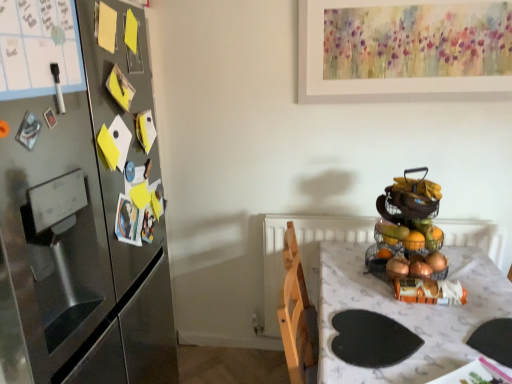
Identify the location of vacant area located to the right-hand side of wire mesh basket at right, the 2th basket when ordered from top to bottom. This screenshot has height=384, width=512. (476, 277).